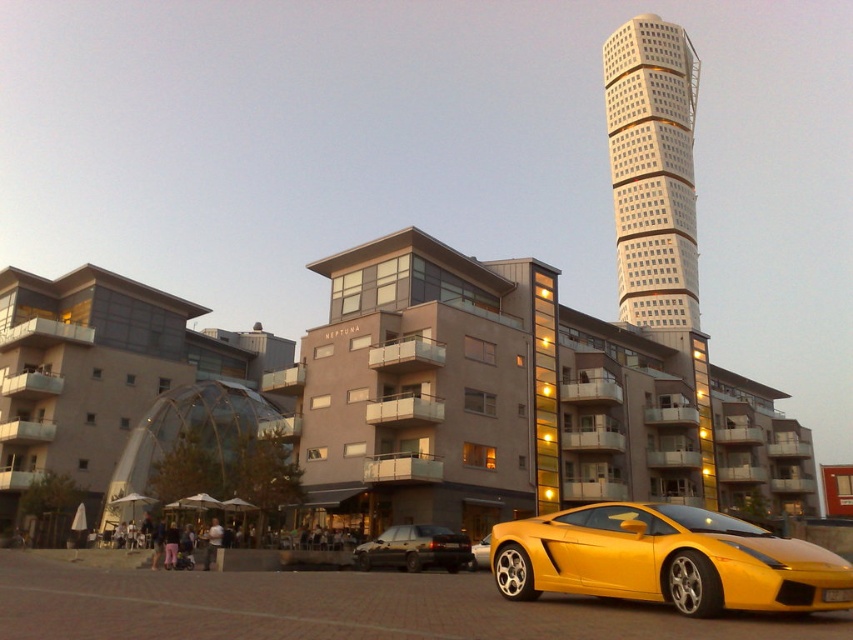
You are a delivery drone that needs to fly from the metallic yellow sports car at lower right to the nearest building in the background. Can you safely navigate the space between them?

The metallic yellow sports car at lower right and the nearest building in the background are 18.39 meters apart, so yes, the drone can safely navigate the space between them since the distance is sufficient for flight.

What object is located at the coordinates point (653, 170) in the image?

The point (653, 170) corresponds to the white glass tower at upper center.

You are a photographer planning to capture both the matte black sedan at center and the yellow matte sports car at lower center in a single frame. Given their sizes, which car should you position closer to the camera to ensure both appear balanced in the photo?

To balance the matte black sedan at center and the yellow matte sports car at lower center in the photo, position the smaller yellow matte sports car at lower center closer to the camera since the matte black sedan at center is larger in size.